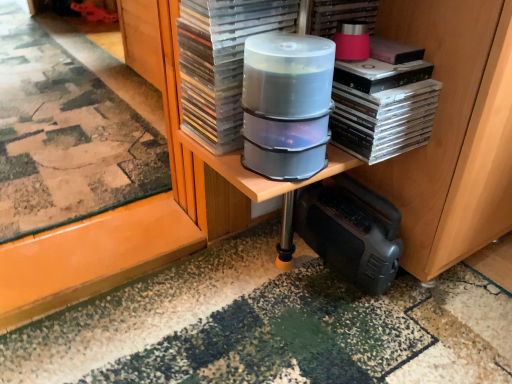
Question: Looking at their shapes, would you say transparent plastic case at center, which is the 1th paperback book in left-to-right order, is wider or thinner than clear plastic container at center, placed as the first appliance when sorted from top to bottom?

Choices:
 (A) thin
 (B) wide

Answer: (B)

Question: Is transparent plastic case at center, marked as the second paperback book in a right-to-left arrangement, to the left or to the right of clear plastic container at center, placed as the first appliance when sorted from top to bottom, in the image?

Choices:
 (A) right
 (B) left

Answer: (B)

Question: Which of these objects is positioned closest to the clear plastic cd cases at center?

Choices:
 (A) black plastic speaker at lower right, acting as the 1th appliance starting from the back
 (B) clear plastic container at center, placed as the first appliance when sorted from top to bottom
 (C) transparent plastic case at center, which is the 1th paperback book in left-to-right order
 (D) pink matte paperback book at upper right, the first paperback book when ordered from right to left

Answer: (D)

Question: Which object is positioned farthest from the pink matte paperback book at upper right, the second paperback book when ordered from left to right?

Choices:
 (A) clear plastic cd cases at center
 (B) transparent plastic case at center, which is the 1th paperback book in left-to-right order
 (C) black plastic speaker at lower right, acting as the 1th appliance starting from the back
 (D) clear plastic container at center, marked as the 2th appliance in a back-to-front arrangement

Answer: (C)